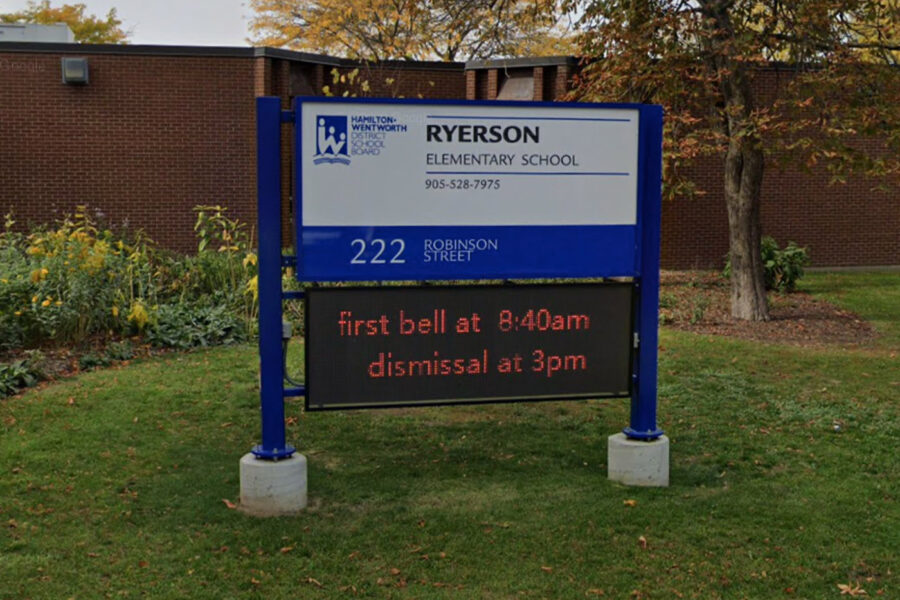
The width and height of the screenshot is (900, 600). Identify the location of light. (76, 67).